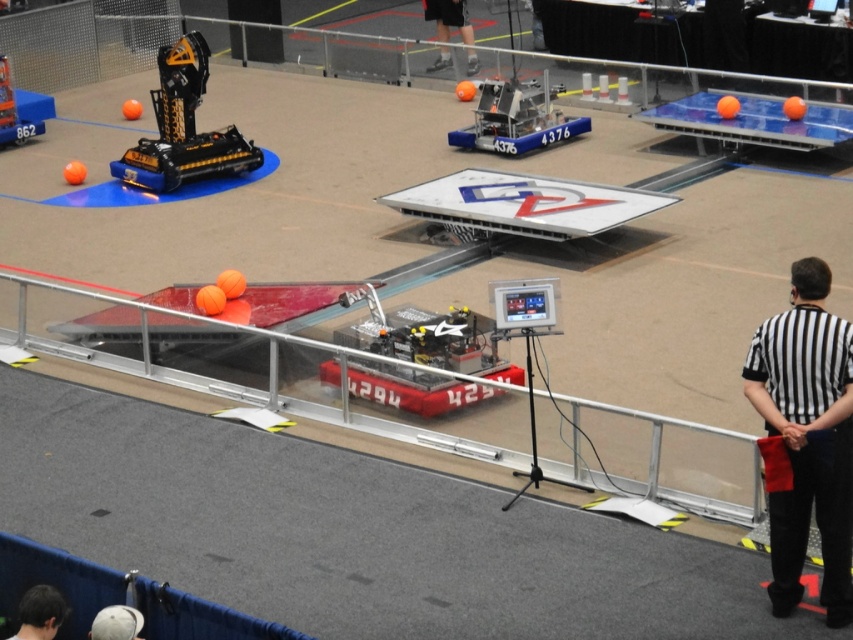
You are a participant in the robotics competition and need to locate the referee wearing a black striped shirt at right. Based on the scene description, where would you expect to find this referee in relation to the robot labeled 4294?

The referee wearing the black striped shirt at right is located at the coordinates point (805,438), which is to the right side of the robot labeled 4294.